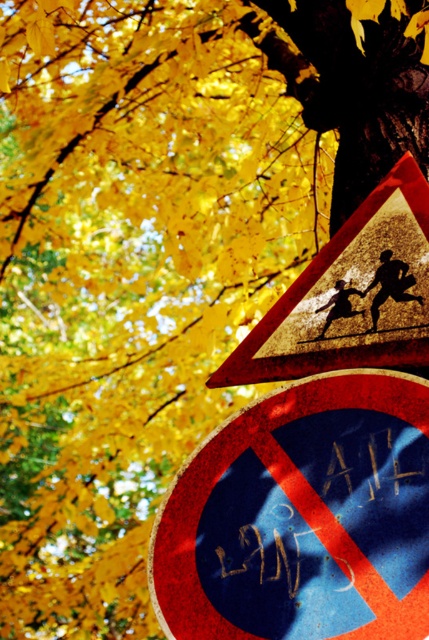
The image size is (429, 640). In order to click on rusty metal sign at lower center in this screenshot , I will do `click(302, 516)`.

Find the location of `rusty metal sign at lower center`. rusty metal sign at lower center is located at coordinates (302, 516).

Image resolution: width=429 pixels, height=640 pixels. In order to click on rusty metal sign at lower center in this screenshot , I will do `click(302, 516)`.

Looking at this image, is rusty metal sign at lower center wider than dark blue paper at center?

Indeed, rusty metal sign at lower center has a greater width compared to dark blue paper at center.

How much distance is there between rusty metal sign at lower center and dark blue paper at center?

A distance of 1.08 inches exists between rusty metal sign at lower center and dark blue paper at center.

Between point (371, 637) and point (368, 451), which one is positioned in front?

Point (371, 637) is in front.

The height and width of the screenshot is (640, 429). Find the location of `rusty metal sign at lower center`. rusty metal sign at lower center is located at coordinates (302, 516).

Does dark blue paper at center appear over metallic reflective triangle at upper center?

Incorrect, dark blue paper at center is not positioned above metallic reflective triangle at upper center.

Can you confirm if dark blue paper at center is thinner than metallic reflective triangle at upper center?

Yes, dark blue paper at center is thinner than metallic reflective triangle at upper center.

I want to click on dark blue paper at center, so click(325, 504).